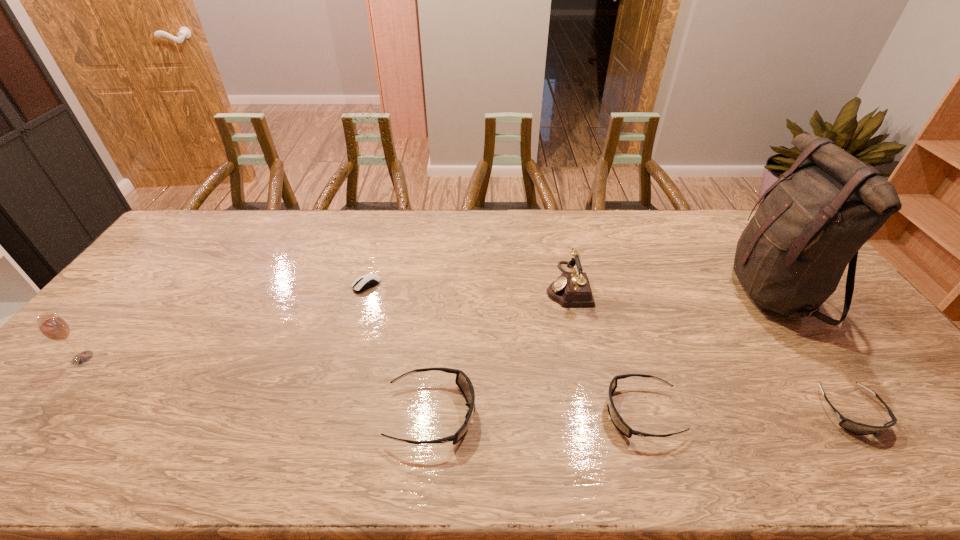
The goggless are evenly distributed in the image. To maintain this, where would you place another goggles on the left? Please point to a free space. Please provide its 2D coordinates. Your answer should be formatted as a tuple, i.e. [(x, y)], where the tuple contains the x and y coordinates of a point satisfying the conditions above.

[(221, 416)]